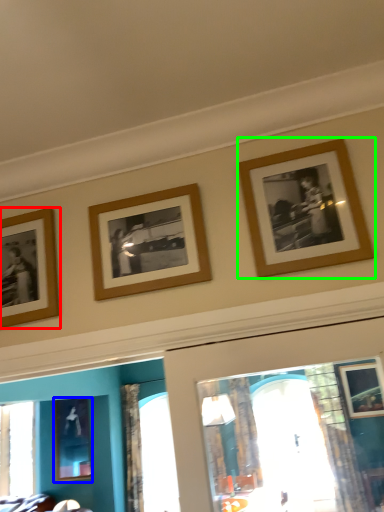
Question: Estimate the real-world distances between objects in this image. Which object is farther from picture frame (highlighted by a red box), picture frame (highlighted by a blue box) or picture frame (highlighted by a green box)?

Choices:
 (A) picture frame
 (B) picture frame

Answer: (A)